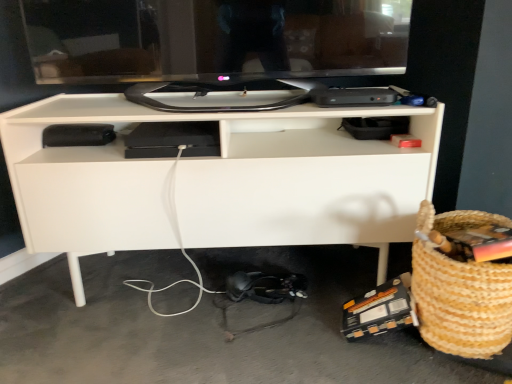
Question: Are black glossy monitor at upper center and white matte desk at center far apart?

Choices:
 (A) yes
 (B) no

Answer: (B)

Question: From the image's perspective, would you say black glossy monitor at upper center is positioned over white matte desk at center?

Choices:
 (A) no
 (B) yes

Answer: (B)

Question: From a real-world perspective, does black glossy monitor at upper center sit lower than white matte desk at center?

Choices:
 (A) no
 (B) yes

Answer: (A)

Question: Is black glossy monitor at upper center placed right next to white matte desk at center?

Choices:
 (A) no
 (B) yes

Answer: (A)

Question: Is black glossy monitor at upper center oriented away from white matte desk at center?

Choices:
 (A) no
 (B) yes

Answer: (A)

Question: Looking at their shapes, would you say black glossy monitor at upper center is wider or thinner than white matte desk at center?

Choices:
 (A) thin
 (B) wide

Answer: (A)

Question: Visually, is black glossy monitor at upper center positioned to the left or to the right of white matte desk at center?

Choices:
 (A) left
 (B) right

Answer: (A)

Question: From a real-world perspective, relative to white matte desk at center, is black glossy monitor at upper center vertically above or below?

Choices:
 (A) below
 (B) above

Answer: (B)

Question: Considering their positions, is black glossy monitor at upper center located in front of or behind white matte desk at center?

Choices:
 (A) behind
 (B) front

Answer: (B)

Question: From a real-world perspective, is white matte desk at center positioned above or below black glossy monitor at upper center?

Choices:
 (A) above
 (B) below

Answer: (B)

Question: From the image's perspective, is white matte desk at center positioned above or below black glossy monitor at upper center?

Choices:
 (A) above
 (B) below

Answer: (B)

Question: Considering the positions of white matte desk at center and black glossy monitor at upper center in the image, is white matte desk at center bigger or smaller than black glossy monitor at upper center?

Choices:
 (A) small
 (B) big

Answer: (B)

Question: From their relative heights in the image, would you say white matte desk at center is taller or shorter than black glossy monitor at upper center?

Choices:
 (A) tall
 (B) short

Answer: (A)

Question: In terms of width, does black glossy monitor at upper center look wider or thinner when compared to braided straw basket at lower right?

Choices:
 (A) thin
 (B) wide

Answer: (A)

Question: Would you say black glossy monitor at upper center is inside or outside braided straw basket at lower right?

Choices:
 (A) outside
 (B) inside

Answer: (A)